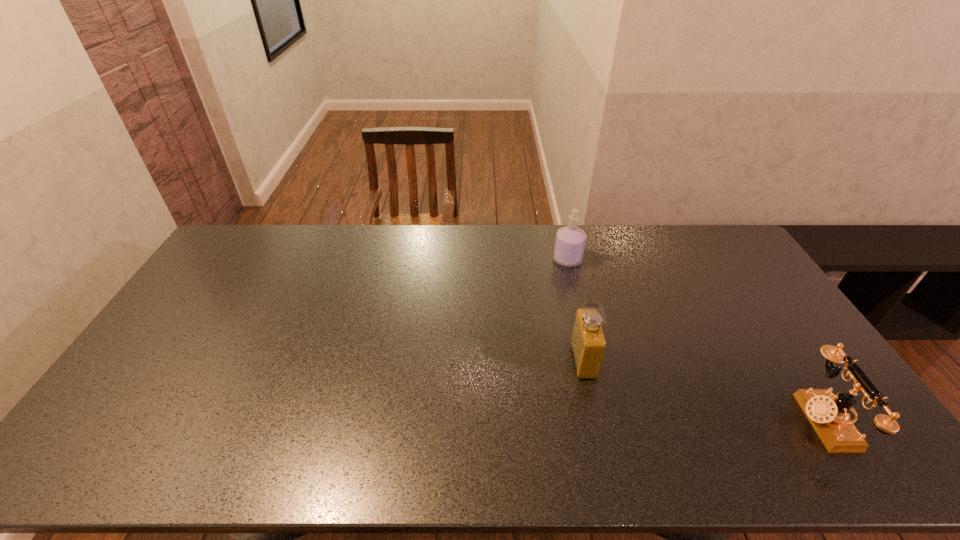
Locate an element on the screen. This screenshot has width=960, height=540. vacant region between the rightmost object and the nearer perfume is located at coordinates (703, 390).

The image size is (960, 540). Find the location of `empty location between the nearer perfume and the farthest object`. empty location between the nearer perfume and the farthest object is located at coordinates (575, 310).

Locate an element on the screen. The image size is (960, 540). free spot between the nearer perfume and the telephone is located at coordinates (703, 390).

Find the location of `vacant point located between the telephone and the farthest object`. vacant point located between the telephone and the farthest object is located at coordinates pos(695,340).

Image resolution: width=960 pixels, height=540 pixels. Identify the location of free space between the nearer perfume and the rightmost object. (703, 390).

The height and width of the screenshot is (540, 960). Identify the location of vacant space in between the nearer perfume and the farther perfume. (575, 310).

Where is `unoccupied area between the rightmost object and the nearer perfume`? Image resolution: width=960 pixels, height=540 pixels. unoccupied area between the rightmost object and the nearer perfume is located at coordinates (703, 390).

Locate an element on the screen. The image size is (960, 540). unoccupied area between the nearer perfume and the farther perfume is located at coordinates (575, 310).

Point out which object is positioned as the nearest to the farthest object. Please provide its 2D coordinates. Your answer should be formatted as a tuple, i.e. [(x, y)], where the tuple contains the x and y coordinates of a point satisfying the conditions above.

[(588, 343)]

The width and height of the screenshot is (960, 540). I want to click on object that stands as the closest to the nearer perfume, so click(570, 241).